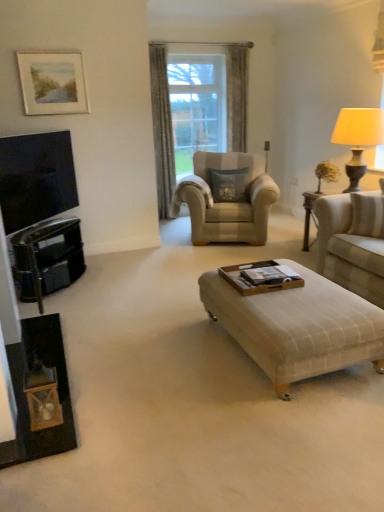
Question: Should I look upward or downward to see plaid fabric ottoman at center?

Choices:
 (A) up
 (B) down

Answer: (B)

Question: Is the surface of beige fabric couch at right in direct contact with matte beige lampshade at right?

Choices:
 (A) no
 (B) yes

Answer: (A)

Question: Is matte beige lampshade at right at the back of beige fabric couch at right?

Choices:
 (A) no
 (B) yes

Answer: (A)

Question: Can you confirm if beige fabric couch at right is smaller than matte beige lampshade at right?

Choices:
 (A) yes
 (B) no

Answer: (B)

Question: Could matte beige lampshade at right be considered to be inside beige fabric couch at right?

Choices:
 (A) yes
 (B) no

Answer: (B)

Question: From a real-world perspective, does beige fabric couch at right sit lower than matte beige lampshade at right?

Choices:
 (A) no
 (B) yes

Answer: (B)

Question: Is the depth of beige fabric couch at right greater than that of matte beige lampshade at right?

Choices:
 (A) yes
 (B) no

Answer: (B)

Question: Is matte white picture frame at upper left at the back of gray textured curtain at center?

Choices:
 (A) yes
 (B) no

Answer: (B)

Question: From a real-world perspective, is gray textured curtain at center located beneath matte white picture frame at upper left?

Choices:
 (A) yes
 (B) no

Answer: (A)

Question: Is gray textured curtain at center not near matte white picture frame at upper left?

Choices:
 (A) no
 (B) yes

Answer: (B)

Question: Is gray textured curtain at center further to camera compared to matte white picture frame at upper left?

Choices:
 (A) yes
 (B) no

Answer: (A)

Question: Is gray textured curtain at center aimed at matte white picture frame at upper left?

Choices:
 (A) yes
 (B) no

Answer: (B)

Question: Can you confirm if gray textured curtain at center is thinner than matte white picture frame at upper left?

Choices:
 (A) yes
 (B) no

Answer: (B)

Question: Is beige fabric couch at right facing away from black glossy dresser at left?

Choices:
 (A) yes
 (B) no

Answer: (B)